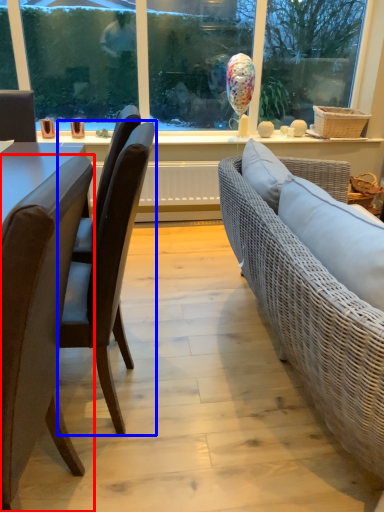
Question: Which point is closer to the camera, chair (highlighted by a red box) or chair (highlighted by a blue box)?

Choices:
 (A) chair
 (B) chair

Answer: (A)